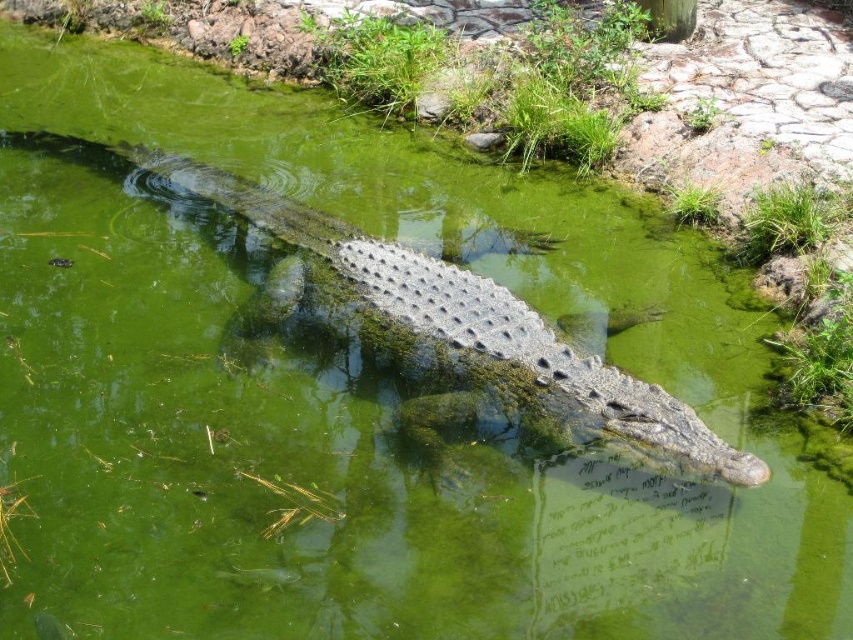
You are a wildlife researcher trying to locate the crocodile in the image. The coordinates given are point [471,317]. Based on the scene description, what object is located at those coordinates?

The point [471,317] corresponds to the gray scaly crocodile at center.